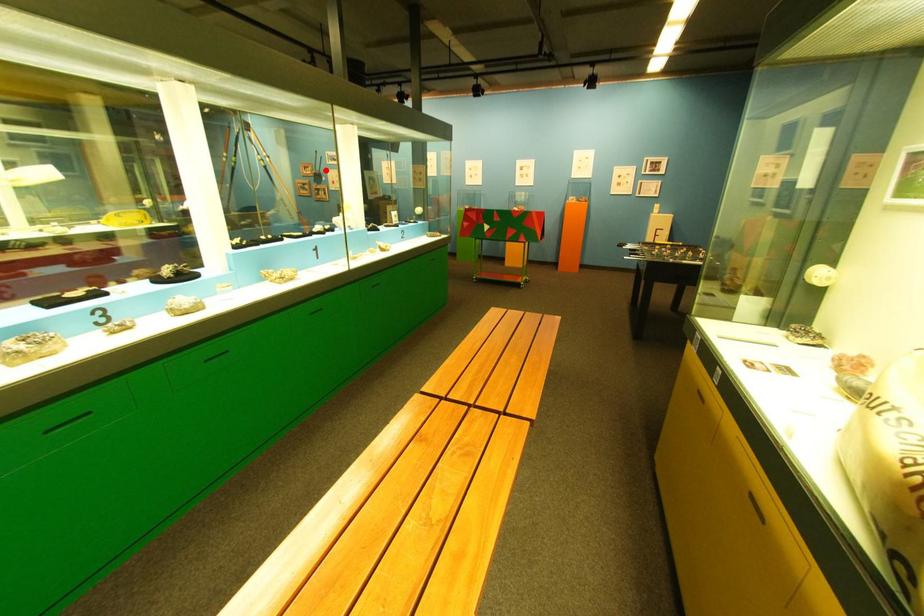
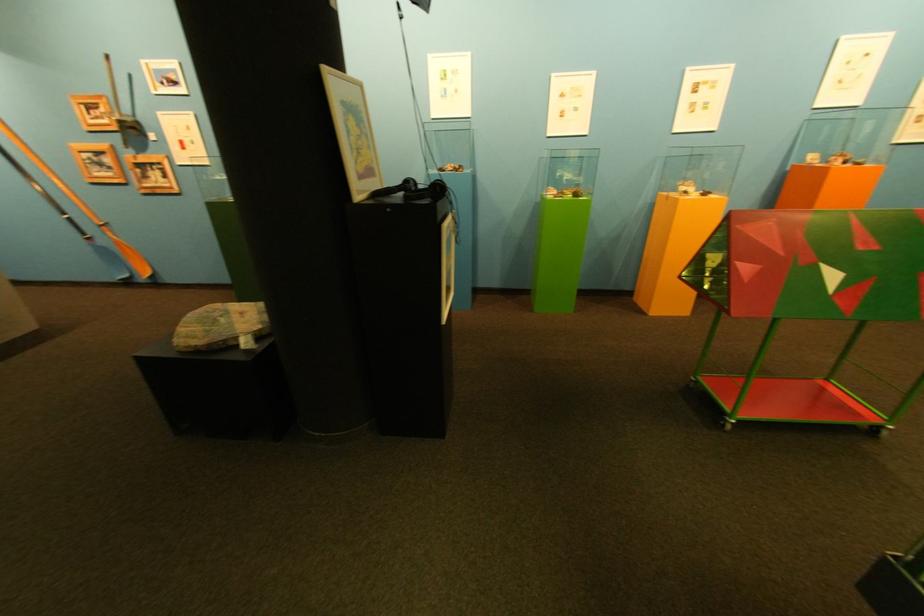
Question: I am providing you with two images of the same scene from different viewpoints. In image1, a red point is highlighted. Considering the same 3D point in image2, which of the following is correct?

Choices:
 (A) It is closer
 (B) It is farther

Answer: (B)